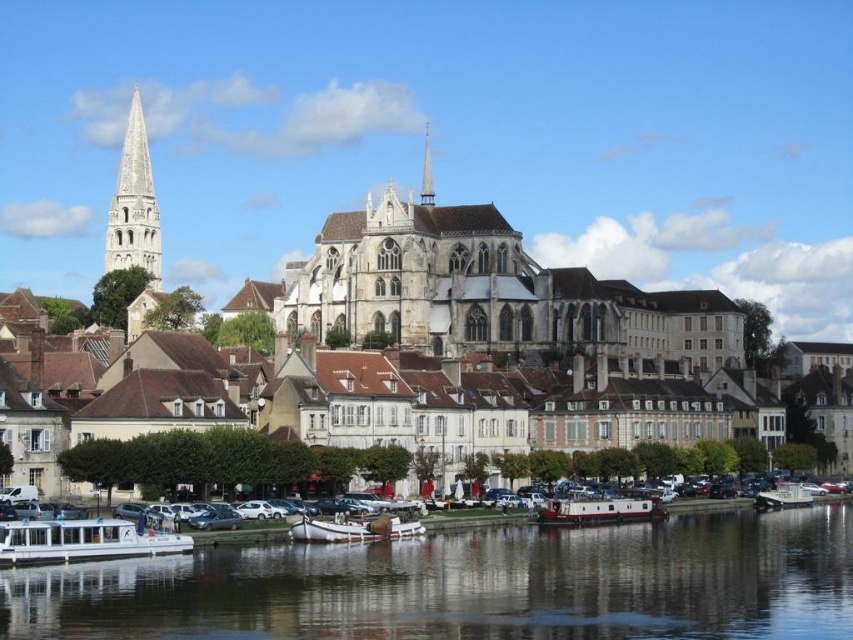
Question: Which point is closer to the camera?

Choices:
 (A) white wooden boat at lower center
 (B) white matte boat at lower left
 (C) white matte houseboat at center

Answer: (B)

Question: Can you confirm if white matte boat at lower left is wider than white matte houseboat at center?

Choices:
 (A) yes
 (B) no

Answer: (B)

Question: Which object is positioned closest to the white stone spire at upper left?

Choices:
 (A) white stone buildings at center
 (B) white matte boat at lower left
 (C) white wooden boat at lower center
 (D) white matte houseboat at center

Answer: (A)

Question: Which point is closer to the camera?

Choices:
 (A) (126, 148)
 (B) (831, 548)

Answer: (B)

Question: Is the position of white matte boat at lower left more distant than that of smooth white spire at center?

Choices:
 (A) yes
 (B) no

Answer: (B)

Question: Is the position of white stone buildings at center less distant than that of white stone spire at upper left?

Choices:
 (A) no
 (B) yes

Answer: (B)